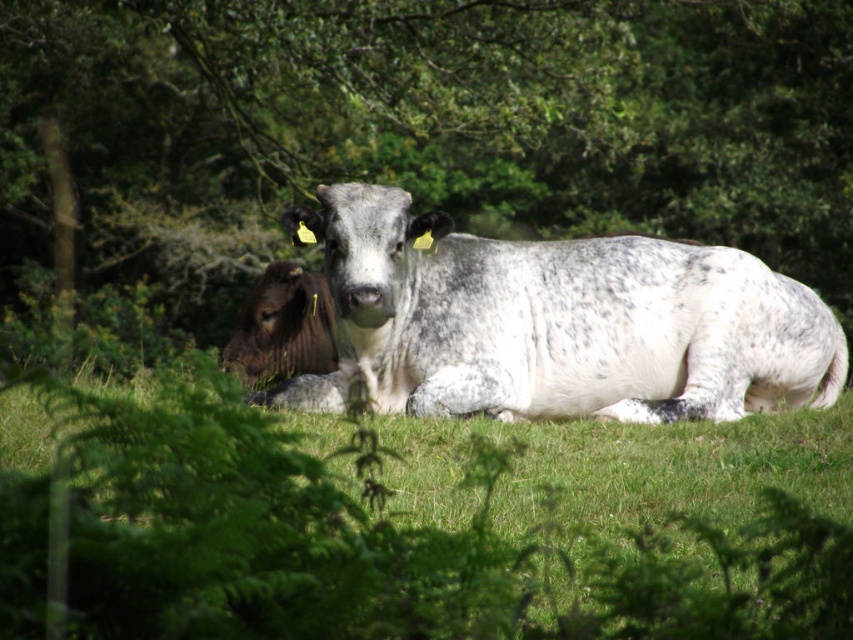
You are a farmer checking your herd. You notice the speckled white cow at center and the dark brown fur at left. Which cow is positioned higher in the field?

The speckled white cow at center is located above dark brown fur at left, so it is positioned higher in the field.

You are a photographer positioned at the edge of the field. You want to take a photo of the green grassy at center and green leafy tree at center. Which object will appear closer to you in the photo?

The green leafy tree at center will appear closer to you in the photo because the green grassy at center is behind it.